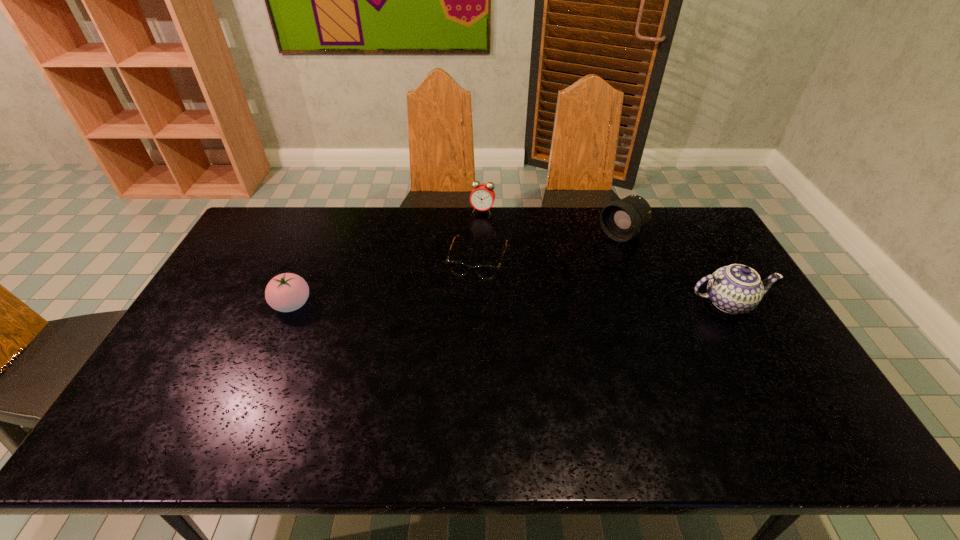
Find the location of `vacant area that lies between the alarm clock and the telephoto lens`. vacant area that lies between the alarm clock and the telephoto lens is located at coordinates (552, 222).

The width and height of the screenshot is (960, 540). What are the coordinates of `vacant space in between the tomato and the spectacles` in the screenshot? It's located at (385, 282).

Identify the location of empty space between the chinaware and the leftmost object. This screenshot has height=540, width=960. (510, 303).

The width and height of the screenshot is (960, 540). Identify the location of empty location between the chinaware and the farthest object. (605, 257).

Image resolution: width=960 pixels, height=540 pixels. Find the location of `free area in between the telephoto lens and the rightmost object`. free area in between the telephoto lens and the rightmost object is located at coordinates (675, 269).

Where is `empty space between the rightmost object and the tomato`? This screenshot has height=540, width=960. empty space between the rightmost object and the tomato is located at coordinates (510, 303).

The height and width of the screenshot is (540, 960). I want to click on vacant point located between the spectacles and the rightmost object, so click(x=603, y=281).

I want to click on the closest object relative to the second object from right to left, so click(x=735, y=289).

At what (x,y) coordinates should I click in order to perform the action: click on object that is the nearest to the alarm clock. Please return your answer as a coordinate pair (x, y). The image size is (960, 540). Looking at the image, I should click on (487, 272).

Locate an element on the screen. vacant area that satisfies the following two spatial constraints: 1. on the back side of the shortest object; 2. on the left side of the tomato is located at coordinates (311, 260).